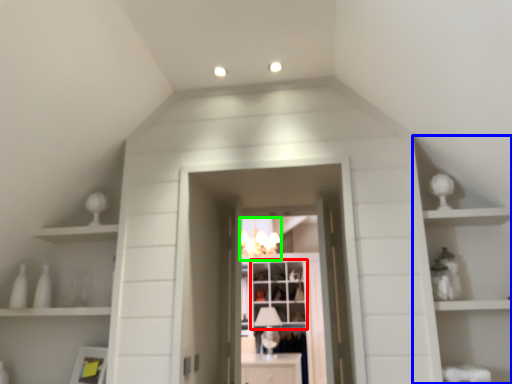
Question: Estimate the real-world distances between objects in this image. Which object is farther from window (highlighted by a red box), cabinet (highlighted by a blue box) or light fixture (highlighted by a green box)?

Choices:
 (A) cabinet
 (B) light fixture

Answer: (A)